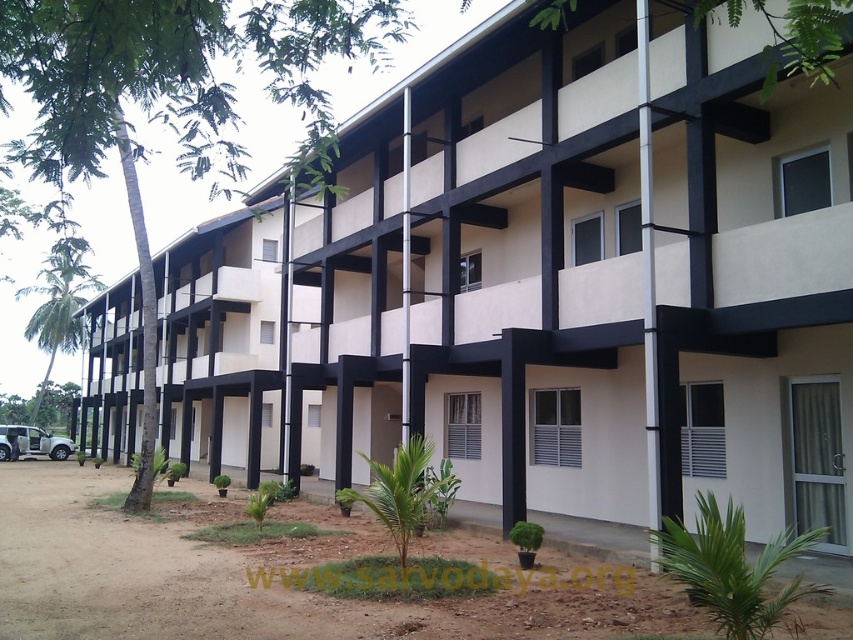
You are standing in front of the building and want to reach the point marked as point [74,58]. If you are currently 20 feet away from the building, can you walk straight towards it to reach the point without moving sideways?

The point [74,58] is 15.97 feet from the viewer. Since you are currently 20 feet away from the building, you are farther away than the point itself. Therefore, walking straight towards the building will bring you closer, but you might need to adjust your path sideways to align with the point once you reach the appropriate distance.

Consider the image. You are standing at the entrance of the building and see the point marked at coordinates point (173, 99). Based on the scene description, can you determine what object this point is located on?

The point (173, 99) is located on the green leafy tree at left.

You are standing in front of the building and see the green leafy tree at left and the green leafy palm tree at left. Which one is positioned more to the left side?

The green leafy palm tree at left is positioned more to the left because the green leafy tree at left is to the right of it.